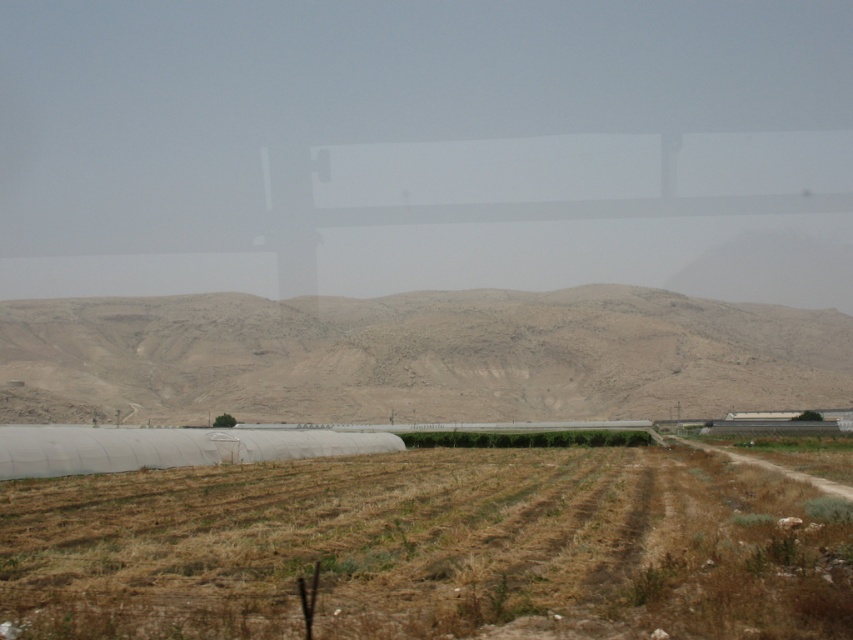
Question: Which point is farther to the camera?

Choices:
 (A) desert-like brown mountain at center
 (B) brown grassy field at lower center

Answer: (A)

Question: From the image, what is the correct spatial relationship of brown grassy field at lower center in relation to desert-like brown mountain at center?

Choices:
 (A) below
 (B) above

Answer: (A)

Question: Which object is farther from the camera taking this photo?

Choices:
 (A) desert-like brown mountain at center
 (B) brown grassy field at lower center

Answer: (A)

Question: Is brown grassy field at lower center smaller than desert-like brown mountain at center?

Choices:
 (A) no
 (B) yes

Answer: (B)

Question: Can you confirm if brown grassy field at lower center is positioned below desert-like brown mountain at center?

Choices:
 (A) no
 (B) yes

Answer: (B)

Question: Which of the following is the closest to the observer?

Choices:
 (A) desert-like brown mountain at center
 (B) brown grassy field at lower center

Answer: (B)